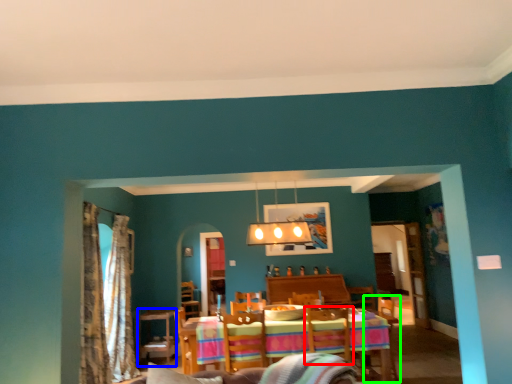
Question: Based on their relative distances, which object is farther from swivel chair (highlighted by a red box)? Choose from table (highlighted by a blue box) and armchair (highlighted by a green box).

Choices:
 (A) table
 (B) armchair

Answer: (B)